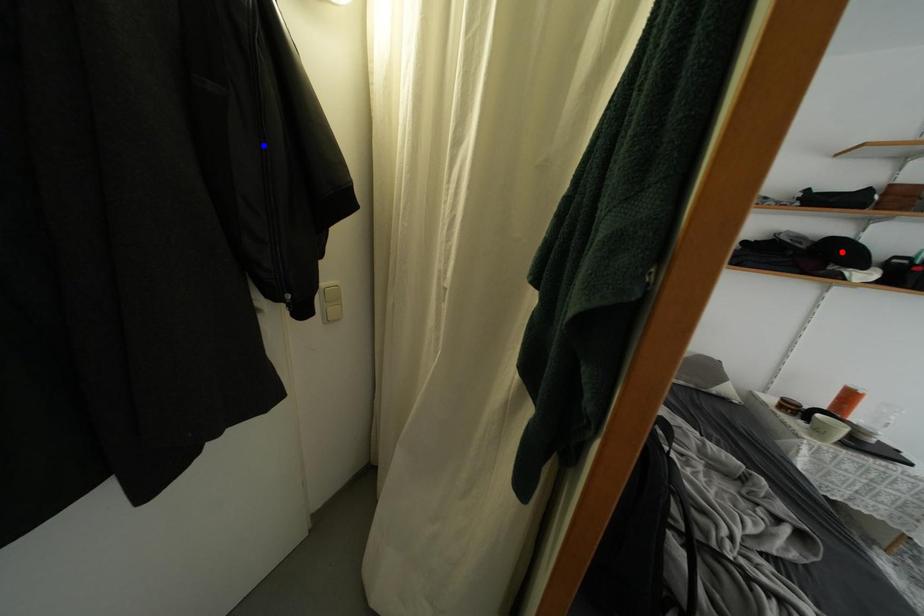
Question: Which of the two points in the image is closer to the camera?

Choices:
 (A) Blue point is closer.
 (B) Red point is closer.

Answer: (A)